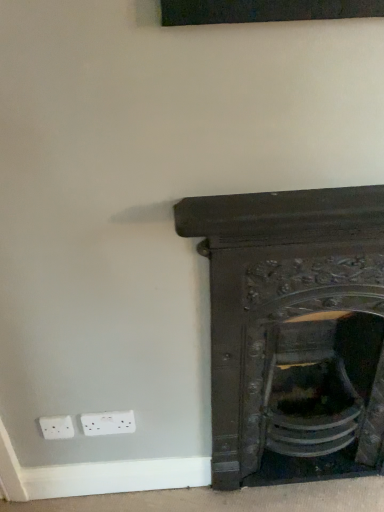
Where is `blank space above dark wood fireplace at lower right (from a real-world perspective)`? This screenshot has width=384, height=512. blank space above dark wood fireplace at lower right (from a real-world perspective) is located at coordinates (302, 190).